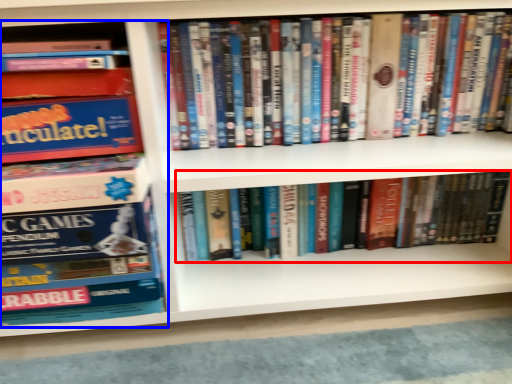
Question: Which object is closer to the camera taking this photo, book (highlighted by a red box) or book (highlighted by a blue box)?

Choices:
 (A) book
 (B) book

Answer: (B)